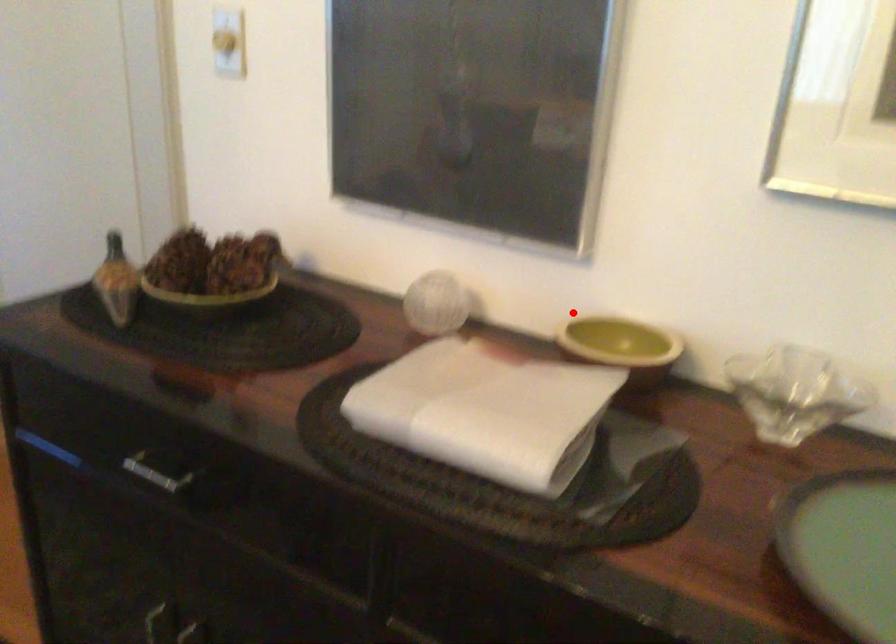
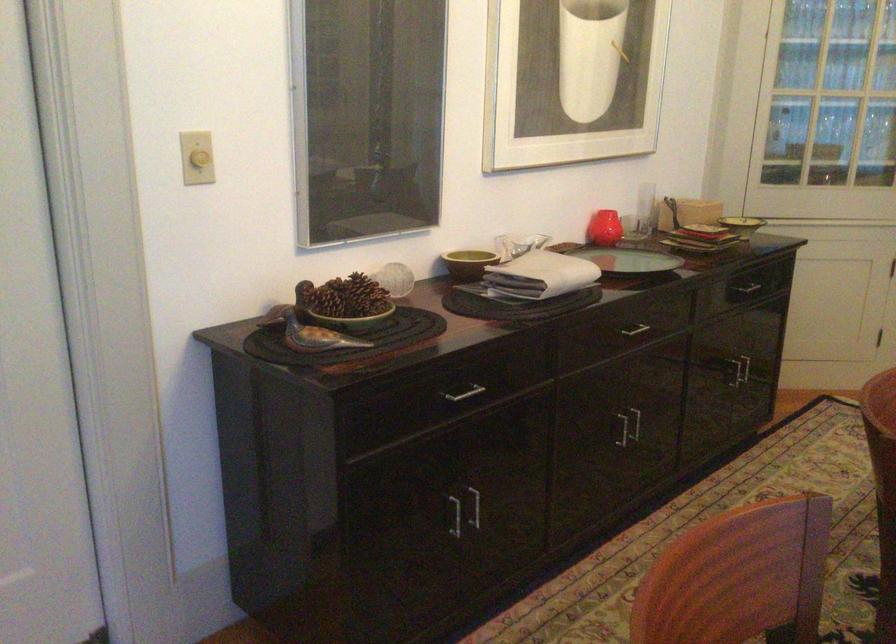
Question: I am providing you with two images of the same scene from different viewpoints. Given a red point in image1, look at the same physical point in image2. Is it:

Choices:
 (A) Closer to the viewpoint
 (B) Farther from the viewpoint

Answer: (B)